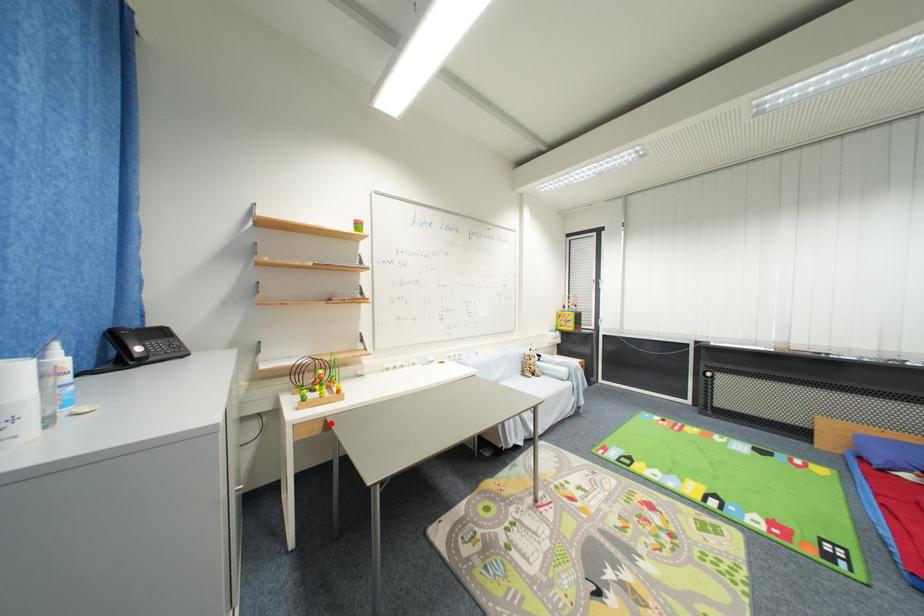
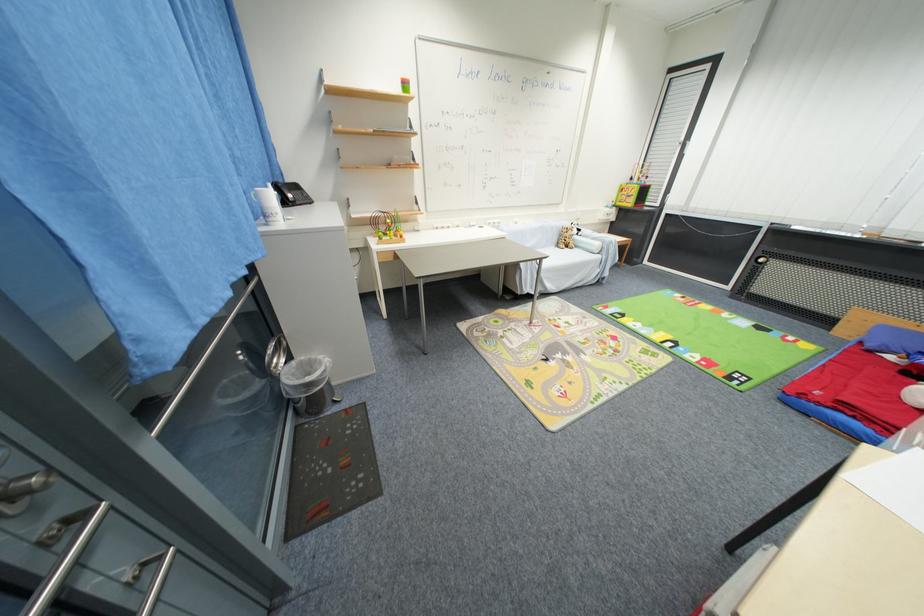
Question: I am providing you with two images of the same scene from different viewpoints. In image1, a red point is highlighted. Considering the same 3D point in image2, which of the following is correct?

Choices:
 (A) It is closer
 (B) It is farther

Answer: (B)